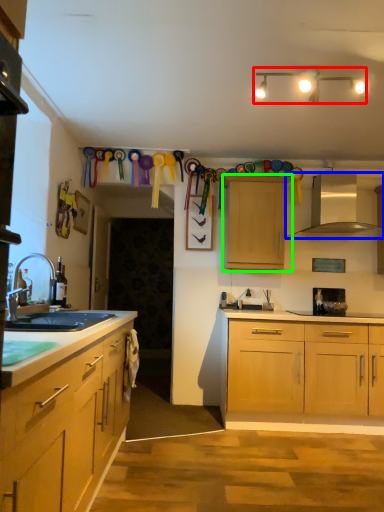
Question: Which object is the farthest from lamp (highlighted by a red box)? Choose among these: exhaust hood (highlighted by a blue box) or cabinetry (highlighted by a green box).

Choices:
 (A) exhaust hood
 (B) cabinetry

Answer: (A)